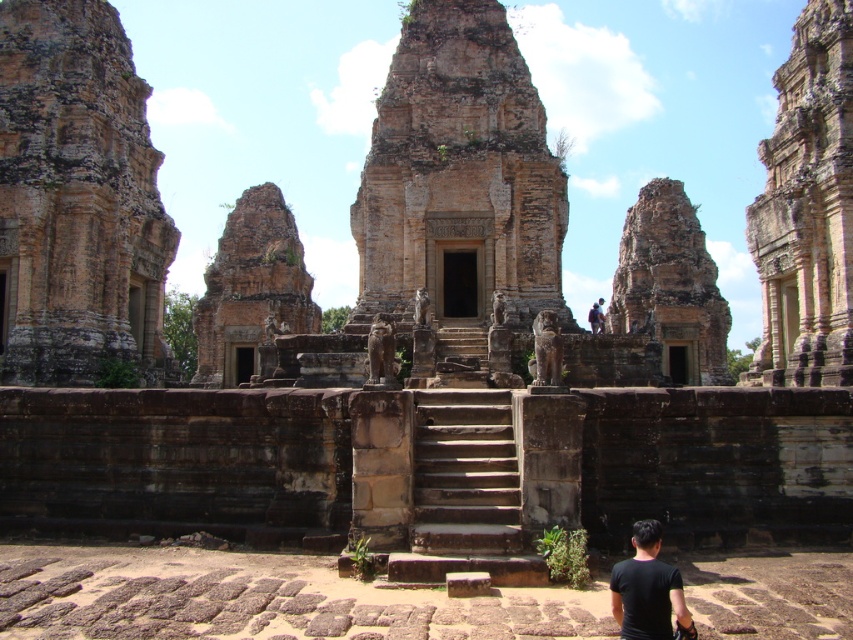
You are a tourist planning to take a photo of the rustic stone tower at left and the rusty stone ruin at center. Which one should you move closer to in order to capture both in the frame without zooming?

You should move closer to the rustic stone tower at left because it is smaller than the rusty stone ruin at center, allowing both to fit in the frame when positioned nearer to the smaller structure.

Consider the image. You are a tourist standing at the entrance of the temple complex. You want to take a photo of both the rustic stone tower at left and the rustic stone tower at right. Which tower should you move towards to include both in your camera frame?

You should move towards the center between the rustic stone tower at left and the rustic stone tower at right since the rustic stone tower at left is positioned on the left side of the rustic stone tower at right, allowing both to be captured in the frame when centered.